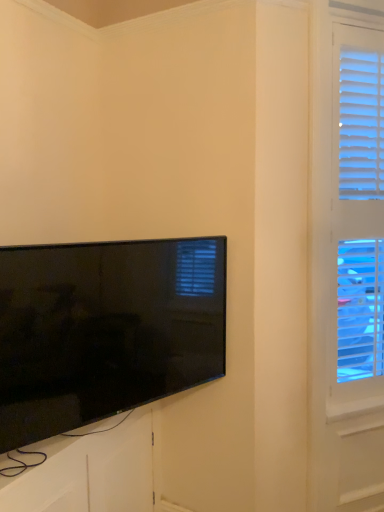
Question: Is flat-screen tv at lower left bigger or smaller than white textured blinds at right?

Choices:
 (A) small
 (B) big

Answer: (A)

Question: Is flat-screen tv at lower left inside or outside of white textured blinds at right?

Choices:
 (A) inside
 (B) outside

Answer: (B)

Question: From the image's perspective, is flat-screen tv at lower left above or below white textured blinds at right?

Choices:
 (A) below
 (B) above

Answer: (A)

Question: Is point (344, 280) positioned closer to the camera than point (26, 350)?

Choices:
 (A) closer
 (B) farther

Answer: (B)

Question: From their relative heights in the image, would you say white textured blinds at right is taller or shorter than flat-screen tv at lower left?

Choices:
 (A) tall
 (B) short

Answer: (A)

Question: From a real-world perspective, is white textured blinds at right physically located above or below flat-screen tv at lower left?

Choices:
 (A) above
 (B) below

Answer: (A)

Question: Is white textured blinds at right to the left or to the right of flat-screen tv at lower left in the image?

Choices:
 (A) left
 (B) right

Answer: (B)